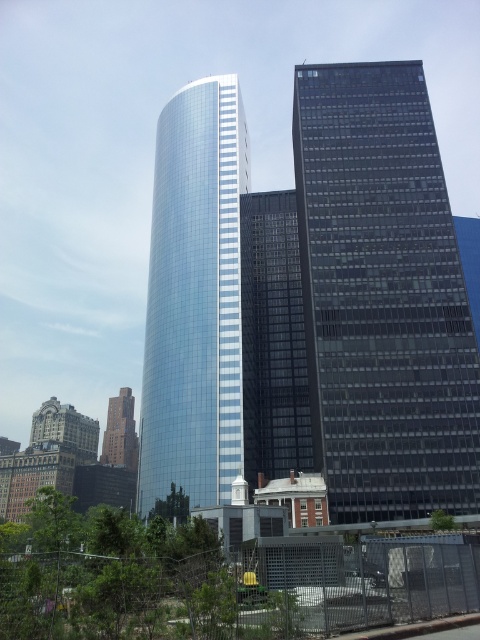
Is dark glass skyscraper at right further to the viewer compared to brick building at lower left?

No, it is in front of brick building at lower left.

Who is more distant from viewer, (376, 442) or (105, 440)?

The point (105, 440) is more distant.

Which is behind, point (405, 472) or point (123, 392)?

The point (123, 392) is more distant.

Image resolution: width=480 pixels, height=640 pixels. I want to click on dark glass skyscraper at right, so click(x=383, y=296).

Between glossy glass tower at center and brick building at lower left, which one is positioned higher?

glossy glass tower at center is above.

Who is shorter, glossy glass tower at center or brick building at lower left?

With less height is brick building at lower left.

Between point (196, 225) and point (108, 417), which one is positioned behind?

The point (108, 417) is behind.

At what (x,y) coordinates should I click in order to perform the action: click on glossy glass tower at center. Please return your answer as a coordinate pair (x, y). Image resolution: width=480 pixels, height=640 pixels. Looking at the image, I should click on (194, 301).

Looking at this image, can you confirm if dark glass skyscraper at right is shorter than glossy glass tower at center?

Correct, dark glass skyscraper at right is not as tall as glossy glass tower at center.

Can you confirm if dark glass skyscraper at right is positioned above glossy glass tower at center?

Yes.

What are the coordinates of `dark glass skyscraper at right` in the screenshot? It's located at (383, 296).

I want to click on dark glass skyscraper at right, so click(x=383, y=296).